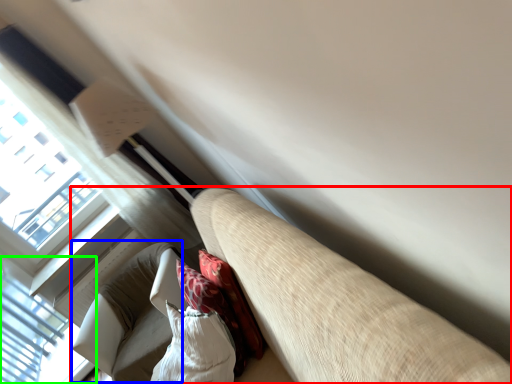
Question: Considering the real-world distances, which object is closest to studio couch (highlighted by a red box)? bean bag chair (highlighted by a blue box) or window (highlighted by a green box).

Choices:
 (A) bean bag chair
 (B) window

Answer: (A)